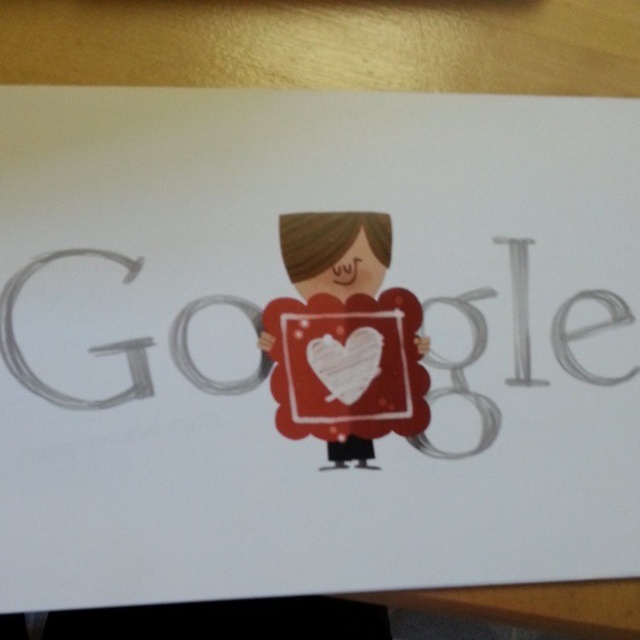
Question: Estimate the real-world distances between objects in this image. Which object is closer to the white paper heart at center?

Choices:
 (A) matte paper girl at center
 (B) matte gray google at center

Answer: (A)

Question: Among these objects, which one is nearest to the camera?

Choices:
 (A) matte gray google at center
 (B) matte paper girl at center
 (C) white paper heart at center

Answer: (A)

Question: Is matte gray google at center further to camera compared to white paper heart at center?

Choices:
 (A) no
 (B) yes

Answer: (A)

Question: Which object is closer to the camera taking this photo?

Choices:
 (A) matte gray google at center
 (B) matte paper girl at center

Answer: (A)

Question: Does matte paper girl at center have a lesser width compared to white paper heart at center?

Choices:
 (A) no
 (B) yes

Answer: (A)

Question: From the image, what is the correct spatial relationship of matte gray google at center in relation to white paper heart at center?

Choices:
 (A) above
 (B) below

Answer: (A)